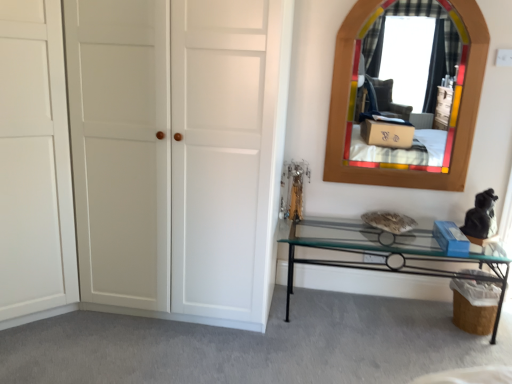
The width and height of the screenshot is (512, 384). Identify the location of free location in front of white matte door at left, which is counted as the 2th door, starting from the left. (160, 355).